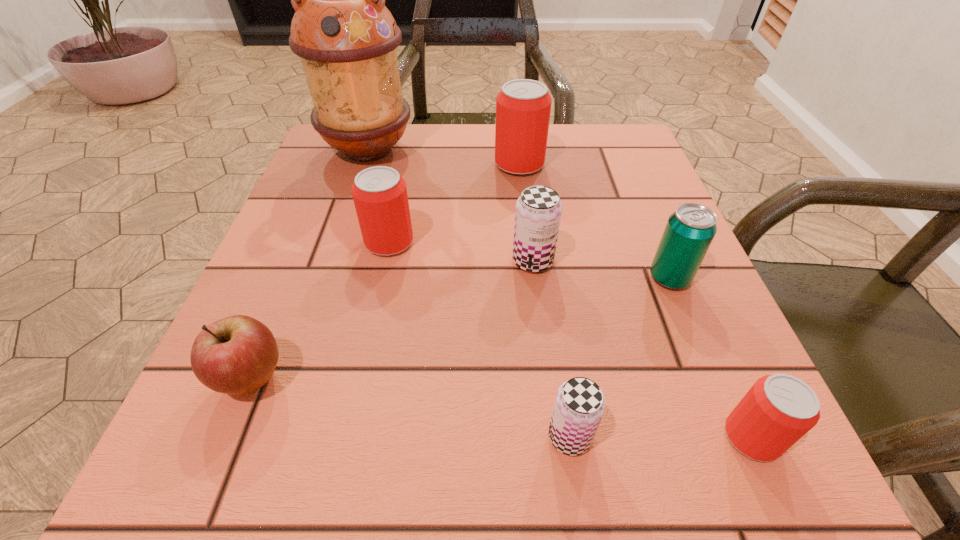
Identify the location of vacant space that satisfies the following two spatial constraints: 1. on the front side of the leftmost beer can; 2. on the right side of the teal beer can. This screenshot has width=960, height=540. (381, 278).